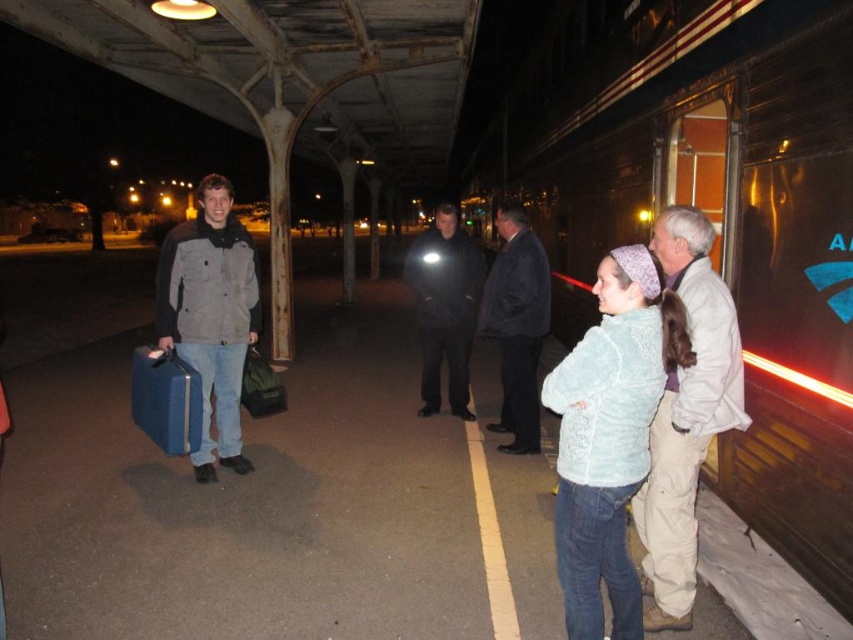
You are a photographer trying to capture a photo of the light blue fuzzy sweater at right and the blue hardshell suitcase at left. Which object should you focus on first if you want to ensure both are in the frame without moving the camera?

The light blue fuzzy sweater at right is larger in size than the blue hardshell suitcase at left, so you should focus on the light blue fuzzy sweater at right first as it takes up more space in the frame.

You are a photographer trying to capture a clear shot of both the black matte jacket at center and the blue hardshell suitcase at left. Given their sizes, which object should you focus on first to ensure both are in frame without zooming in or out?

The black matte jacket at center is larger than the blue hardshell suitcase at left, so you should focus on the black matte jacket at center first to ensure it fits within the frame before adjusting for the smaller suitcase.

You are a photographer positioned at the train station platform. You want to take a photo of the black matte jacket at center and the blue hardshell suitcase at left. The camera you are using has a maximum focus range of 2.5 meters. Will both objects be in focus if you capture them together in the same shot?

The black matte jacket at center is 2.47 meters away from the blue hardshell suitcase at left. Since the distance between them is within the camera maximum focus range of 2.5 meters, both objects will be in focus in the photo.